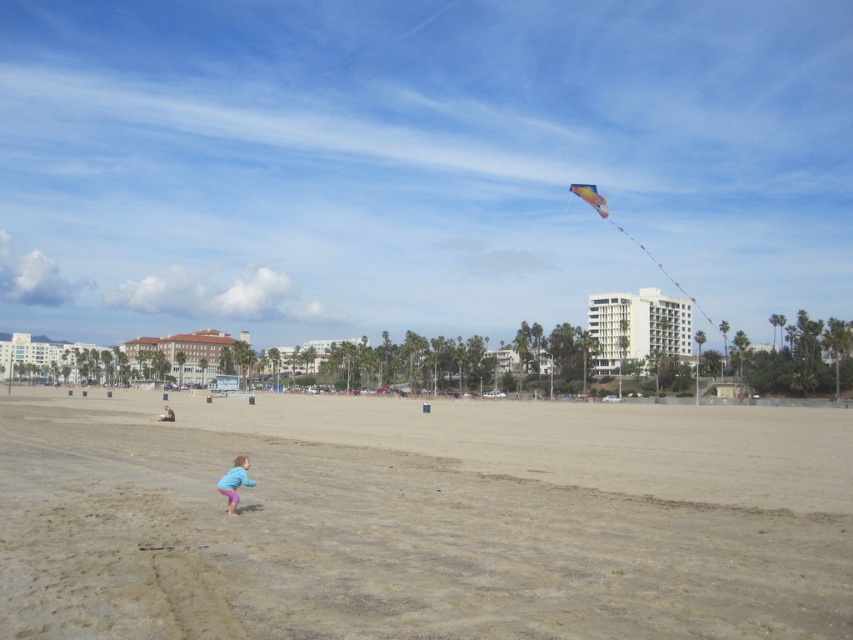
Question: Estimate the real-world distances between objects in this image. Which object is farther from the white glossy building at upper center?

Choices:
 (A) pastel blue shorts at lower center
 (B) multicolored fabric kite at upper right

Answer: (A)

Question: Can you confirm if pastel blue shorts at lower center is smaller than blue cotton shirt at lower center?

Choices:
 (A) yes
 (B) no

Answer: (A)

Question: In this image, where is multicolored fabric kite at upper right located relative to blue cotton shirt at lower center?

Choices:
 (A) below
 (B) above

Answer: (B)

Question: Is multicolored fabric kite at upper right to the right of blue cotton shirt at lower center from the viewer's perspective?

Choices:
 (A) yes
 (B) no

Answer: (A)

Question: Which point appears farthest from the camera in this image?

Choices:
 (A) (173, 419)
 (B) (300, 556)

Answer: (A)

Question: Which of these objects is positioned farthest from the blue cotton shirt at lower center?

Choices:
 (A) pastel blue shorts at lower center
 (B) brown sandy beach at center
 (C) white glossy building at upper center

Answer: (C)